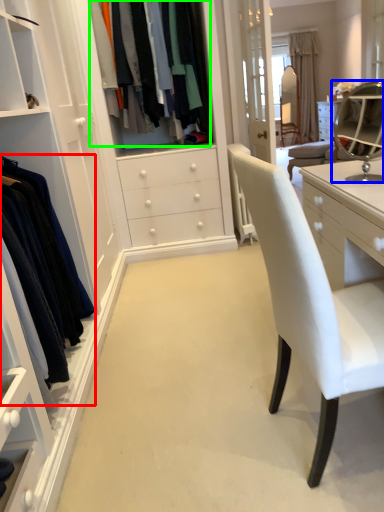
Question: Which object is the farthest from clothing (highlighted by a red box)? Choose among these: mirror (highlighted by a blue box) or clothing (highlighted by a green box).

Choices:
 (A) mirror
 (B) clothing

Answer: (A)